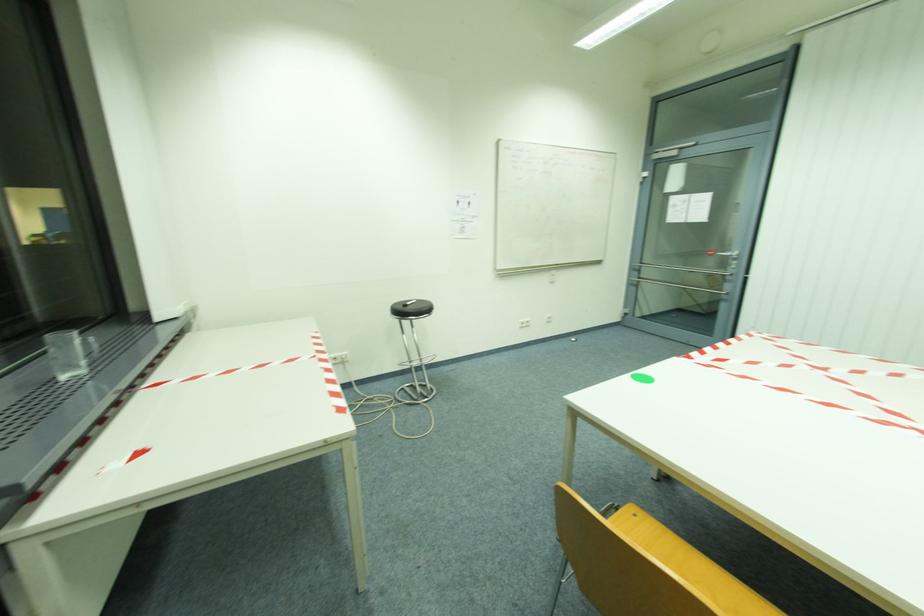
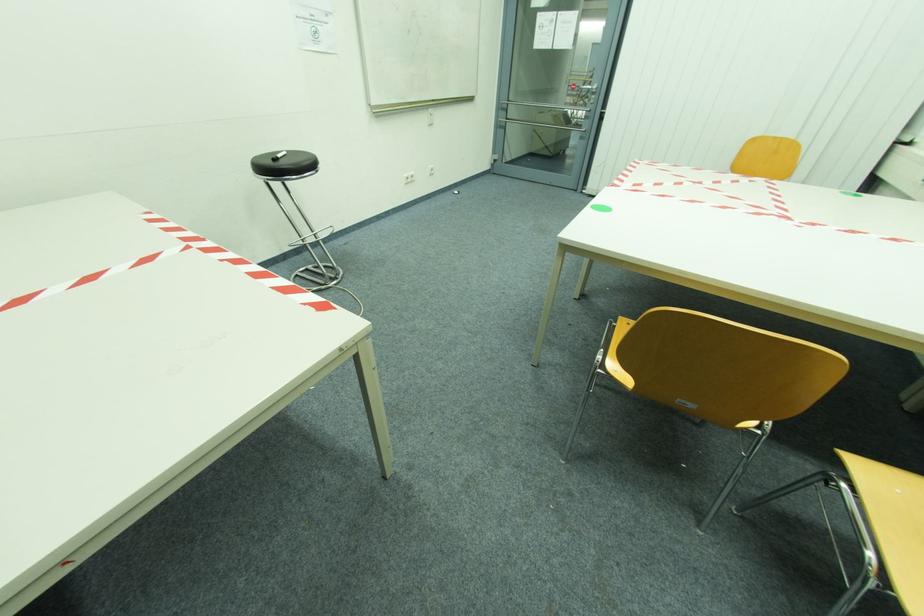
The first image is from the beginning of the video and the second image is from the end. How did the camera likely rotate when shooting the video?

The rotation direction of the camera is right-down.